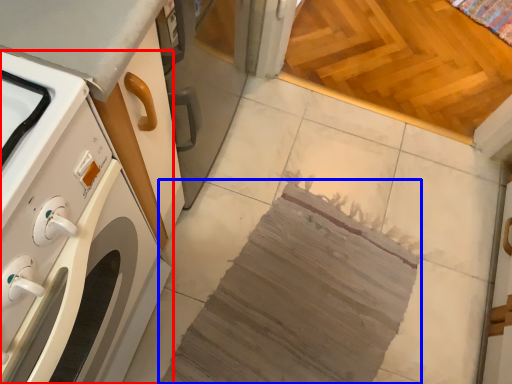
Question: Which object is further to the camera taking this photo, home appliance (highlighted by a red box) or blanket (highlighted by a blue box)?

Choices:
 (A) home appliance
 (B) blanket

Answer: (B)